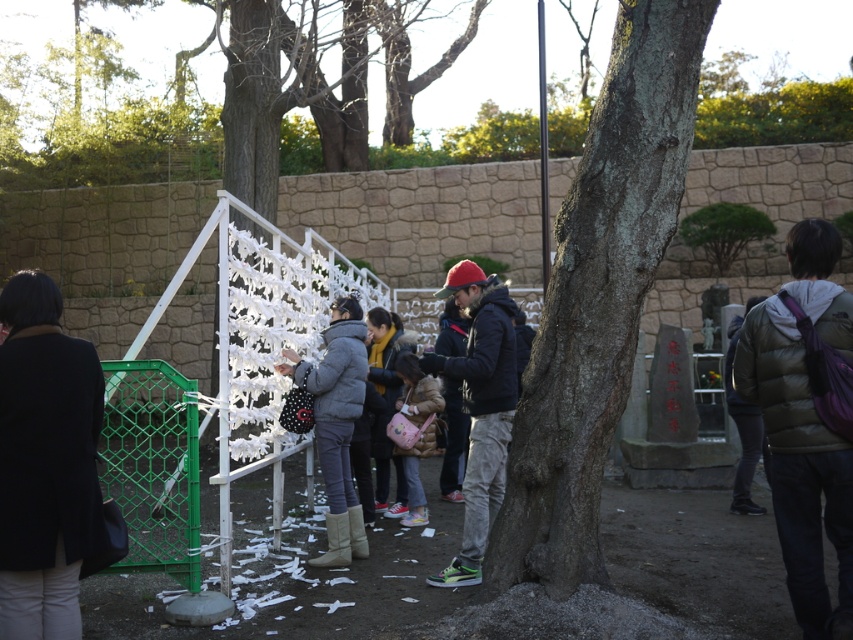
Which of these two, black wool coat at left or green mesh gate at lower left, stands shorter?

green mesh gate at lower left

The width and height of the screenshot is (853, 640). I want to click on black wool coat at left, so click(45, 461).

Does dark brown rough bark tree at center appear on the left side of green puffy jacket at right?

Indeed, dark brown rough bark tree at center is positioned on the left side of green puffy jacket at right.

Between dark brown rough bark tree at center and green puffy jacket at right, which one has less height?

green puffy jacket at right is shorter.

Is point (538, 448) farther from camera compared to point (801, 577)?

Yes, it is.

The width and height of the screenshot is (853, 640). What are the coordinates of `dark brown rough bark tree at center` in the screenshot? It's located at (598, 298).

Does green puffy jacket at right appear over dark gray fleece jacket at center?

Yes, green puffy jacket at right is above dark gray fleece jacket at center.

Which is in front, point (781, 352) or point (444, 369)?

Point (781, 352) is in front.

Who is more forward, (825, 230) or (479, 342)?

Point (825, 230) is in front.

This screenshot has width=853, height=640. In order to click on green puffy jacket at right in this screenshot , I will do `click(799, 467)`.